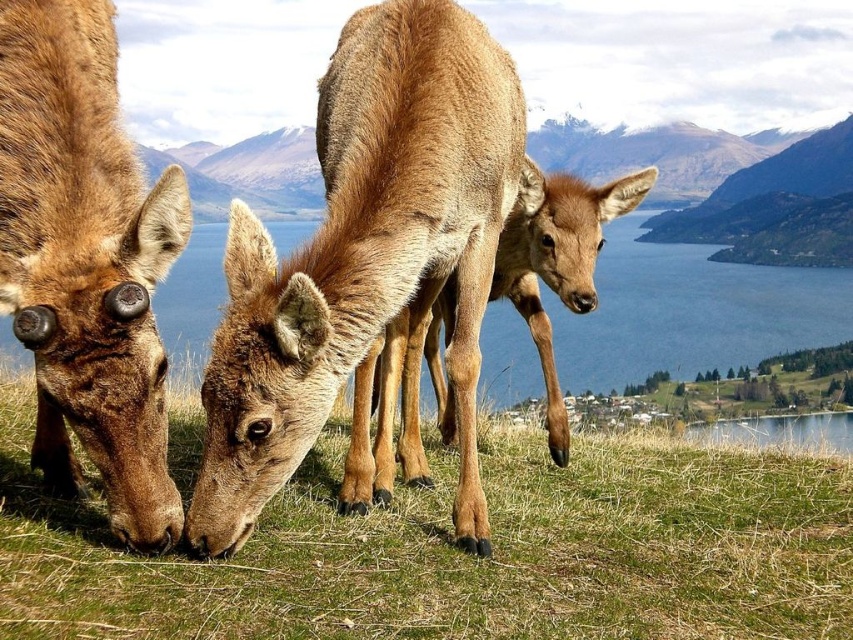
You are a photographer trying to capture the deer in the scene. You notice the green grass at center and the brown matte fur at lower left. Which object is located to the right of the other?

The green grass at center is positioned on the right side of brown matte fur at lower left, so the green grass at center is to the right of the brown matte fur at lower left.

You are a photographer standing at the lower left corner of the image. You want to take a photo of the brown matte fur at lower left. Which direction should you move to get closer to it?

Since the brown matte fur at lower left is located at point (86, 260), which is closer to the lower left corner, you should move towards the center of the image to get closer to it.

You are standing at the viewpoint of the image and want to walk towards the two points marked in the scene. Which point, point (451, 163) or point (480, 374), will you reach first?

Point (451, 163) is in front of point (480, 374), so you will reach point (451, 163) first.